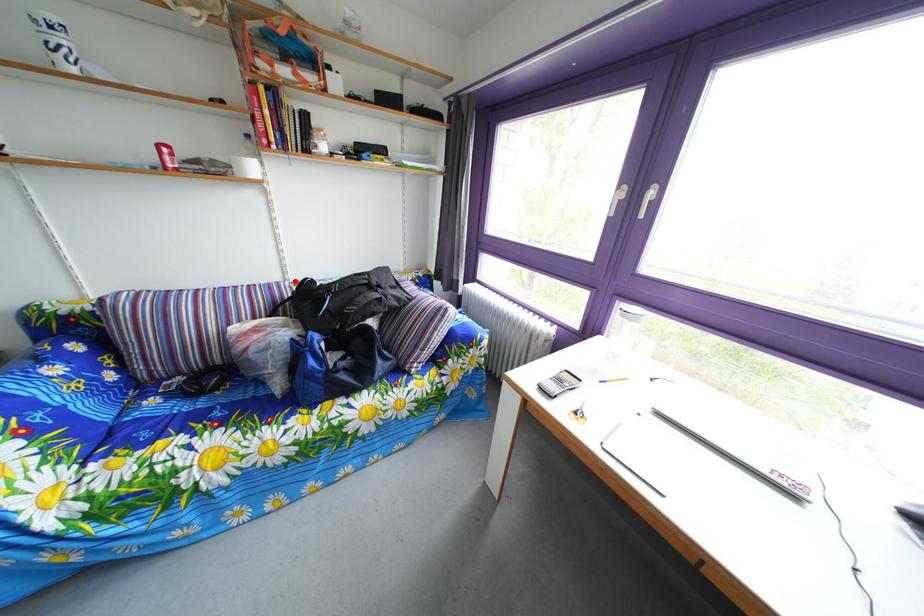
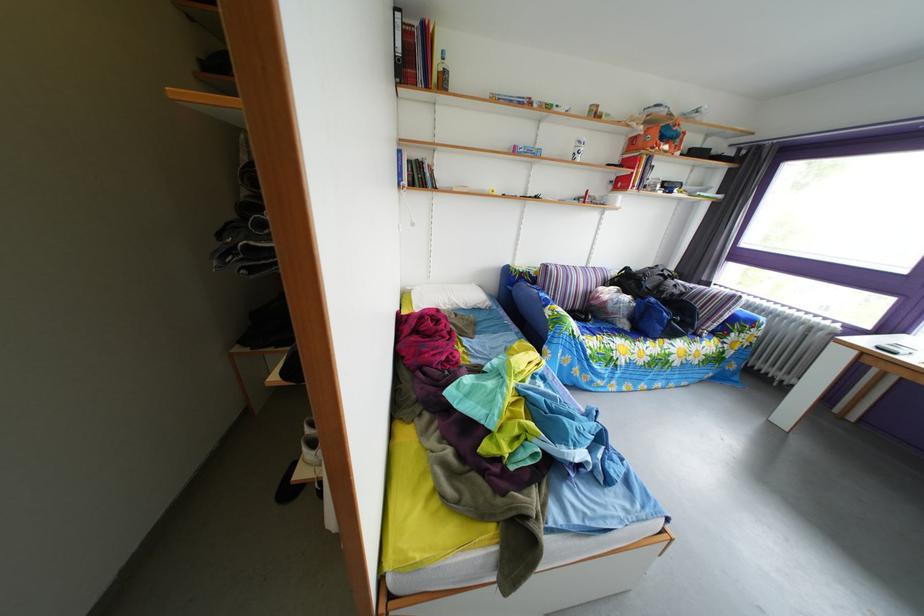
The point at the highlighted location is marked in the first image. Where is the corresponding point in the second image?

(599, 270)